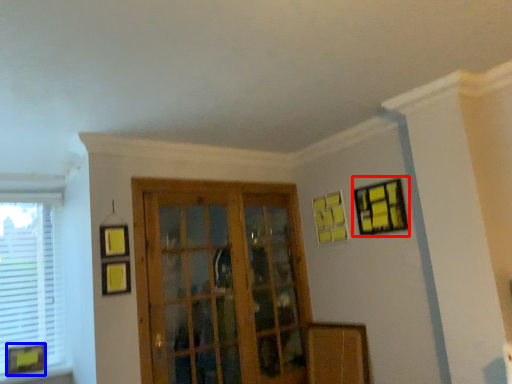
Question: Which of the following is the closest to the observer, picture frame (highlighted by a red box) or picture frame (highlighted by a blue box)?

Choices:
 (A) picture frame
 (B) picture frame

Answer: (A)